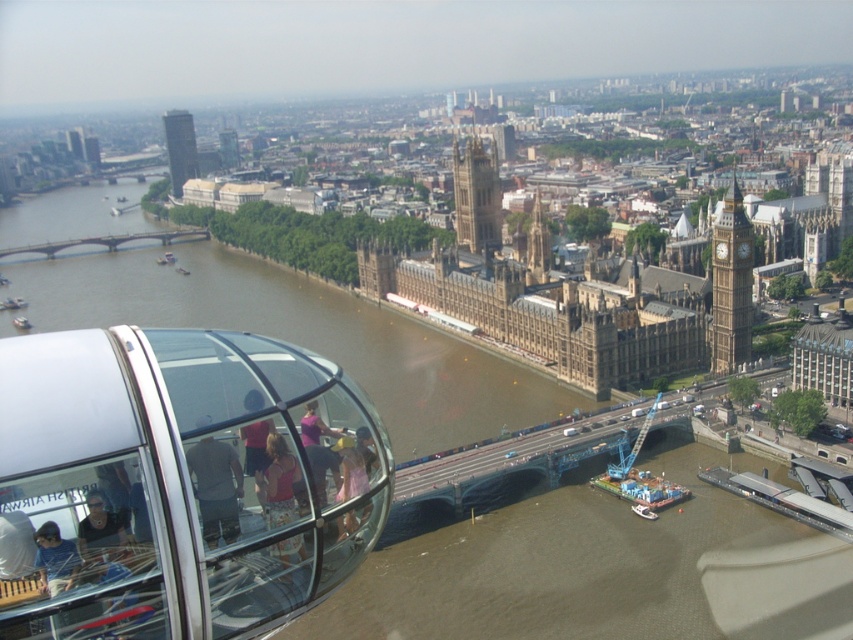
You are a GUI agent. You are given a task and a screenshot of the screen. Output one action in this format:
    pyautogui.click(x=<x>, y=<y>)
    Task: Click on the light brown fabric shirt at center
    This screenshot has height=640, width=853.
    Given the screenshot: What is the action you would take?
    pyautogui.click(x=216, y=488)

Consider the image. Can you confirm if light brown fabric shirt at center is bigger than dark gray concrete tower at upper left?

No, light brown fabric shirt at center is not bigger than dark gray concrete tower at upper left.

Is point (233, 516) less distant than point (173, 138)?

That is True.

I want to click on light brown fabric shirt at center, so click(x=216, y=488).

Based on the photo, between golden stone clock tower at upper center and pink fabric at center, which one has more height?

Answer: golden stone clock tower at upper center is taller.

The width and height of the screenshot is (853, 640). Describe the element at coordinates (476, 196) in the screenshot. I see `golden stone clock tower at upper center` at that location.

What are the coordinates of `golden stone clock tower at upper center` in the screenshot? It's located at (476, 196).

Who is positioned more to the right, golden stone clock tower at upper center or matte pink dress at center?

golden stone clock tower at upper center is more to the right.

Is golden stone clock tower at upper center above matte pink dress at center?

Yes, golden stone clock tower at upper center is above matte pink dress at center.

The height and width of the screenshot is (640, 853). Identify the location of golden stone clock tower at upper center. (x=476, y=196).